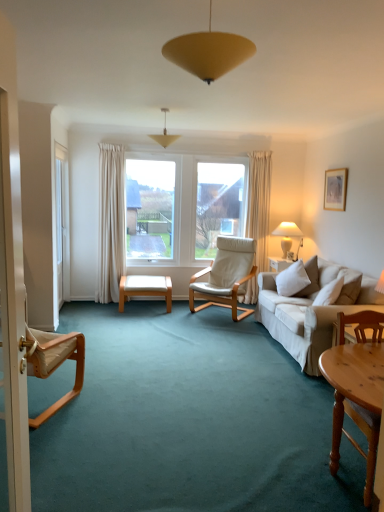
Locate an element on the screen. The height and width of the screenshot is (512, 384). empty space that is ontop of matte yellow cone at center, marked as the 3th lamp in a right-to-left arrangement (from a real-world perspective) is located at coordinates (172, 108).